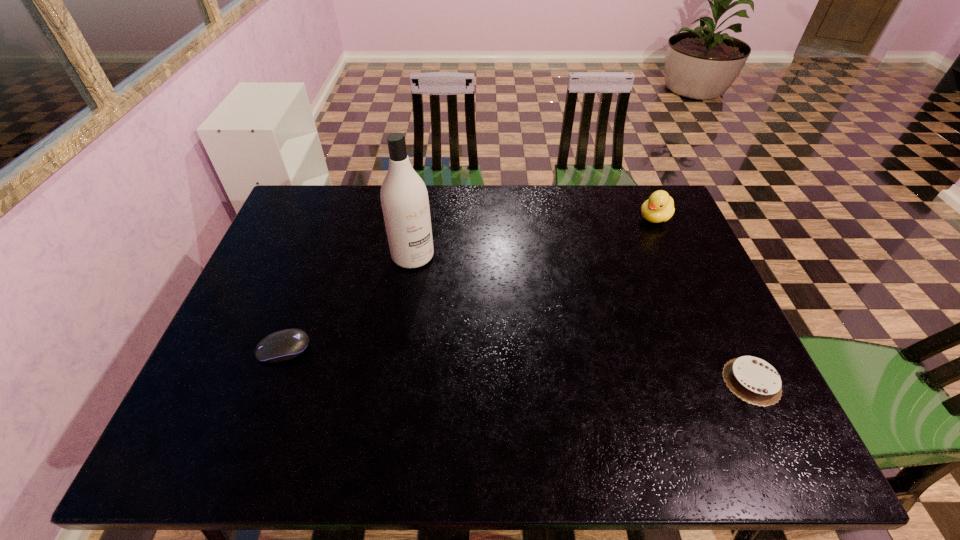
Where is `unoccupied area between the second tallest object and the shampoo`? unoccupied area between the second tallest object and the shampoo is located at coordinates (534, 237).

Find the location of a particular element. The height and width of the screenshot is (540, 960). unoccupied position between the shampoo and the farthest object is located at coordinates (534, 237).

You are a GUI agent. You are given a task and a screenshot of the screen. Output one action in this format:
    pyautogui.click(x=<x>, y=<y>)
    Task: Click on the vacant point located between the farthest object and the second farthest object
    This screenshot has height=540, width=960.
    Given the screenshot: What is the action you would take?
    pyautogui.click(x=534, y=237)

The height and width of the screenshot is (540, 960). I want to click on free space between the shampoo and the chocolate cake, so click(x=582, y=319).

Find the location of a particular element. The width and height of the screenshot is (960, 540). empty space between the shampoo and the third tallest object is located at coordinates (348, 302).

Locate an element on the screen. The image size is (960, 540). unoccupied area between the computer mouse and the duckling is located at coordinates (469, 284).

You are a GUI agent. You are given a task and a screenshot of the screen. Output one action in this format:
    pyautogui.click(x=<x>, y=<y>)
    Task: Click on the empty space between the farthest object and the third object from right to left
    The height and width of the screenshot is (540, 960).
    Given the screenshot: What is the action you would take?
    pyautogui.click(x=534, y=237)

Locate an element on the screen. This screenshot has height=540, width=960. object that is the second nearest to the leftmost object is located at coordinates (753, 380).

Locate an element on the screen. The height and width of the screenshot is (540, 960). object that is the third closest to the tallest object is located at coordinates coord(753,380).

Where is `vacant point that satisfies the following two spatial constraints: 1. on the front side of the farthest object; 2. on the left side of the chocolate cake`? Image resolution: width=960 pixels, height=540 pixels. vacant point that satisfies the following two spatial constraints: 1. on the front side of the farthest object; 2. on the left side of the chocolate cake is located at coordinates pos(728,381).